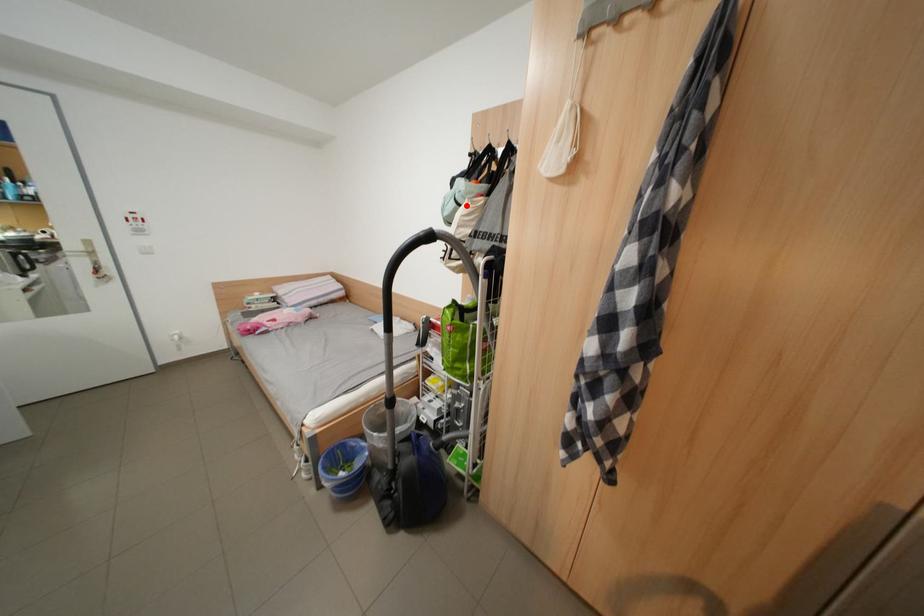
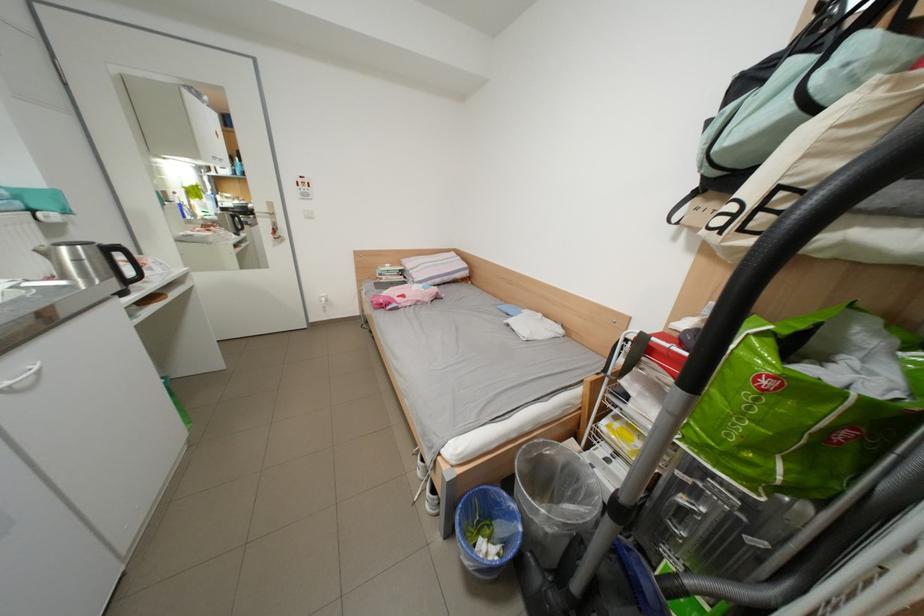
Where in the second image is the point corresponding to the highlighted location from the first image?

(801, 111)